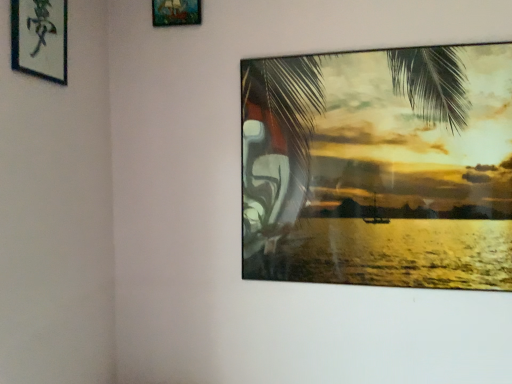
Question: Based on their positions, is wooden frame at upper center, the 2th picture frame when ordered from left to right, located to the left or right of silky green palm tree at upper right?

Choices:
 (A) left
 (B) right

Answer: (A)

Question: Which is correct: wooden frame at upper center, the 2th picture frame positioned from the bottom, is inside silky green palm tree at upper right, or outside of it?

Choices:
 (A) outside
 (B) inside

Answer: (A)

Question: Which object is the closest to the wooden frame at upper center, the 2th picture frame when ordered from left to right?

Choices:
 (A) black paper at upper left, positioned as the first picture frame in front-to-back order
 (B) silky green palm tree at upper right

Answer: (A)

Question: Considering the real-world distances, which object is farthest from the silky green palm tree at upper right?

Choices:
 (A) black paper at upper left, arranged as the second picture frame when viewed from the top
 (B) wooden frame at upper center, placed as the first picture frame when sorted from back to front

Answer: (A)